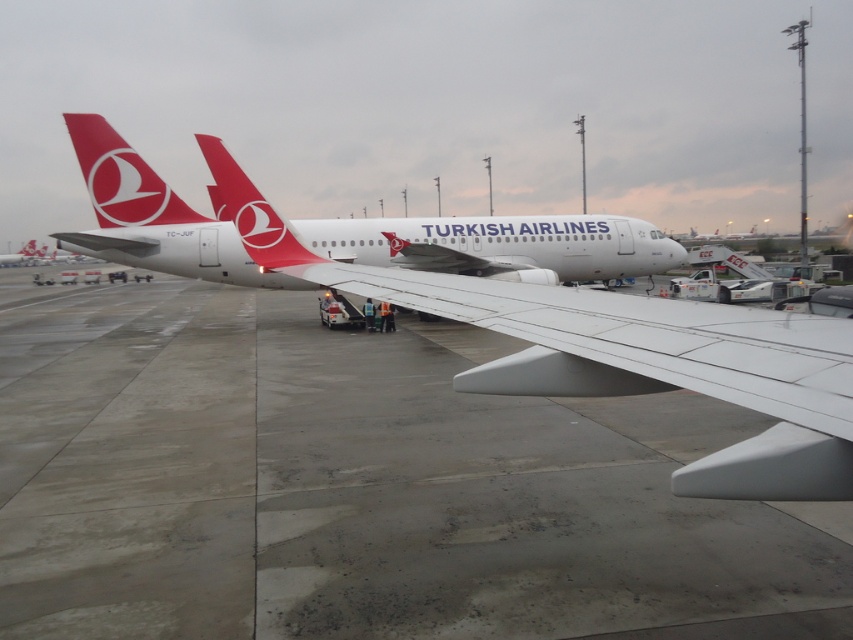
Consider the image. You are a passenger sitting at seat 20A on a plane parked at the airport tarmac. You look out the window and see the point marked at coordinates (x=500, y=244). What object is located exactly at that point?

The point at coordinates (x=500, y=244) marks the white matte airplane at center.

You are a pilot preparing for takeoff and need to check the distance between the white matte airplane at center and the matte red tail at upper center. According to the image, is the distance sufficient for safe clearance if the required minimum is 4 meters?

The white matte airplane at center is 4.18 meters away from the matte red tail at upper center. Since the required minimum is 4 meters, the distance is sufficient for safe clearance.

You are a pilot preparing to board your aircraft at the airport tarmac. You notice a specific point marked at coordinates point [122,179]. Where exactly is this point located on the aircraft?

The point [122,179] is on the matte red tail at upper center of the aircraft.